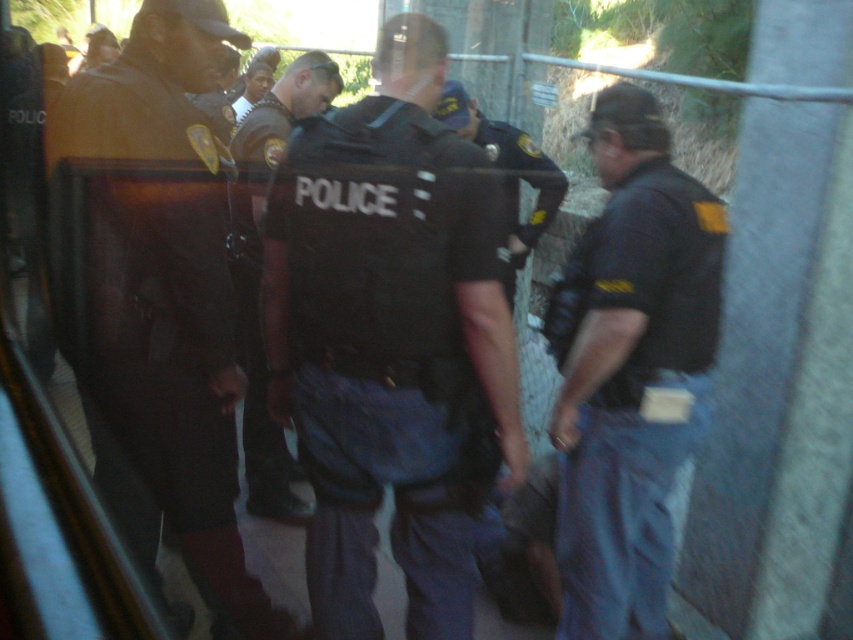
Between black matte police vest at center and dark brown leather jacket at left, which one has more height?

With more height is dark brown leather jacket at left.

Does black matte police vest at center have a lesser width compared to dark brown leather jacket at left?

In fact, black matte police vest at center might be wider than dark brown leather jacket at left.

The width and height of the screenshot is (853, 640). I want to click on black matte police vest at center, so click(x=387, y=339).

Based on the photo, is the position of dark brown leather jacket at left more distant than that of black uniform at center?

No, dark brown leather jacket at left is closer to the viewer.

Is dark brown leather jacket at left smaller than black uniform at center?

No.

Which is behind, point (164, 195) or point (236, 300)?

The point (236, 300) is more distant.

Where is `dark brown leather jacket at left`? dark brown leather jacket at left is located at coordinates (171, 289).

Between black matte police vest at center and smooth skin face at center, which one appears on the left side from the viewer's perspective?

From the viewer's perspective, smooth skin face at center appears more on the left side.

Measure the distance between black matte police vest at center and smooth skin face at center.

black matte police vest at center and smooth skin face at center are 10.27 feet apart from each other.

Find the location of a particular element. This screenshot has width=853, height=640. black matte police vest at center is located at coordinates (387, 339).

Identify the location of black matte police vest at center. (387, 339).